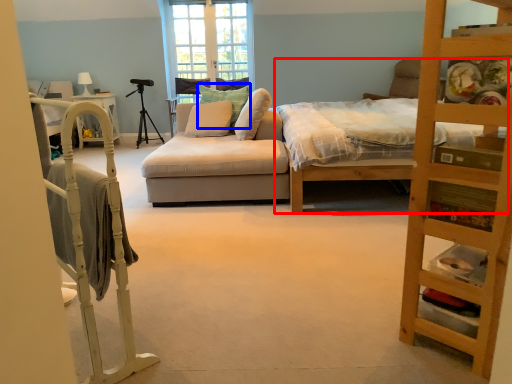
Question: Which object appears farthest to the camera in this image, bed (highlighted by a red box) or pillow (highlighted by a blue box)?

Choices:
 (A) bed
 (B) pillow

Answer: (B)